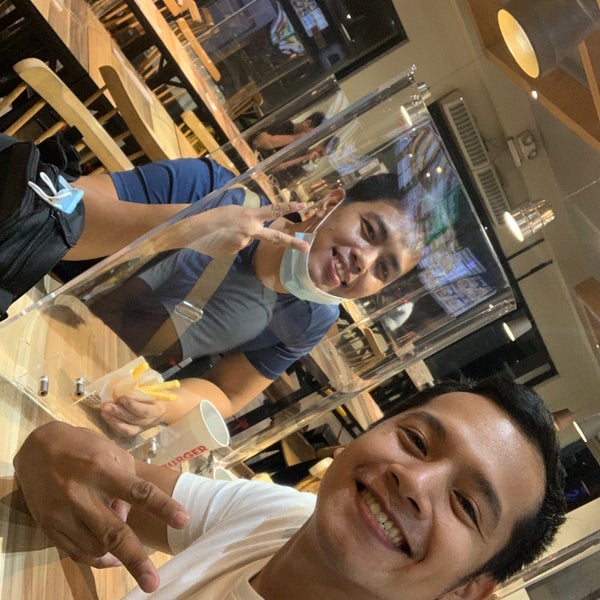
I want to click on chair, so click(83, 135).